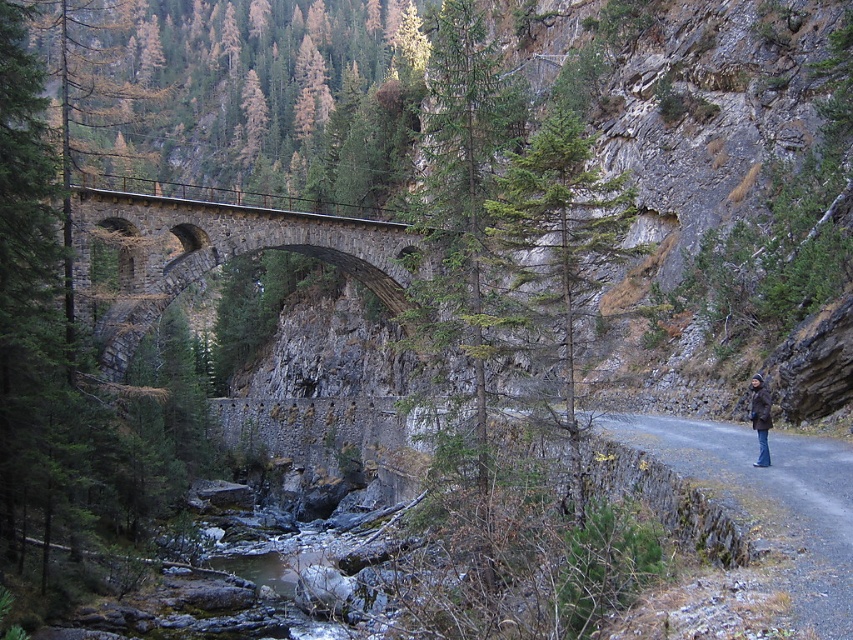
Question: Observing the image, what is the correct spatial positioning of stone arch bridge at center in reference to dark brown leather jacket at right?

Choices:
 (A) below
 (B) above

Answer: (B)

Question: Is stone arch bridge at center bigger than dark brown leather jacket at right?

Choices:
 (A) no
 (B) yes

Answer: (B)

Question: Which point is closer to the camera taking this photo?

Choices:
 (A) (763, 388)
 (B) (358, 272)

Answer: (A)

Question: Among these objects, which one is farthest from the camera?

Choices:
 (A) stone arch bridge at center
 (B) dark brown leather jacket at right

Answer: (A)

Question: From the image, what is the correct spatial relationship of stone arch bridge at center in relation to dark brown leather jacket at right?

Choices:
 (A) left
 (B) right

Answer: (A)